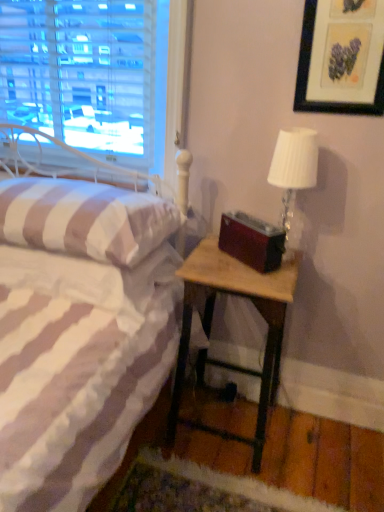
Locate an element on the screen. The width and height of the screenshot is (384, 512). vacant space underneath wooden nightstand at lower right (from a real-world perspective) is located at coordinates (227, 423).